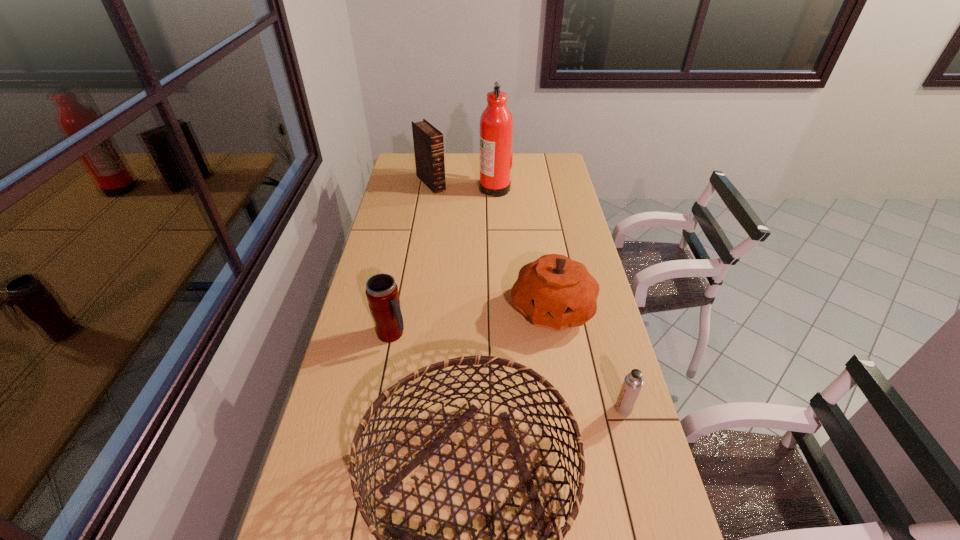
Find the location of a particular element. vacant point that satisfies the following two spatial constraints: 1. on the front-facing side of the pumpkin; 2. on the side with the handle of the taller thermos bottle is located at coordinates (556, 334).

Locate an element on the screen. This screenshot has width=960, height=540. free space in the image that satisfies the following two spatial constraints: 1. on the front-facing side of the shorter thermos bottle; 2. on the right side of the pumpkin is located at coordinates (569, 409).

Locate an element on the screen. Image resolution: width=960 pixels, height=540 pixels. vacant space that satisfies the following two spatial constraints: 1. on the front-facing side of the pumpkin; 2. on the side with the handle of the left thermos bottle is located at coordinates (556, 334).